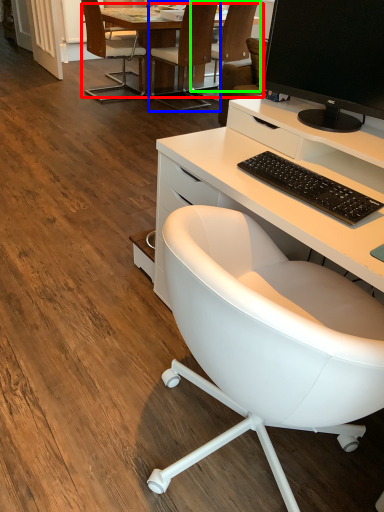
Question: Which object is the closest to the table (highlighted by a red box)? Choose among these: chair (highlighted by a blue box) or chair (highlighted by a green box).

Choices:
 (A) chair
 (B) chair

Answer: (A)